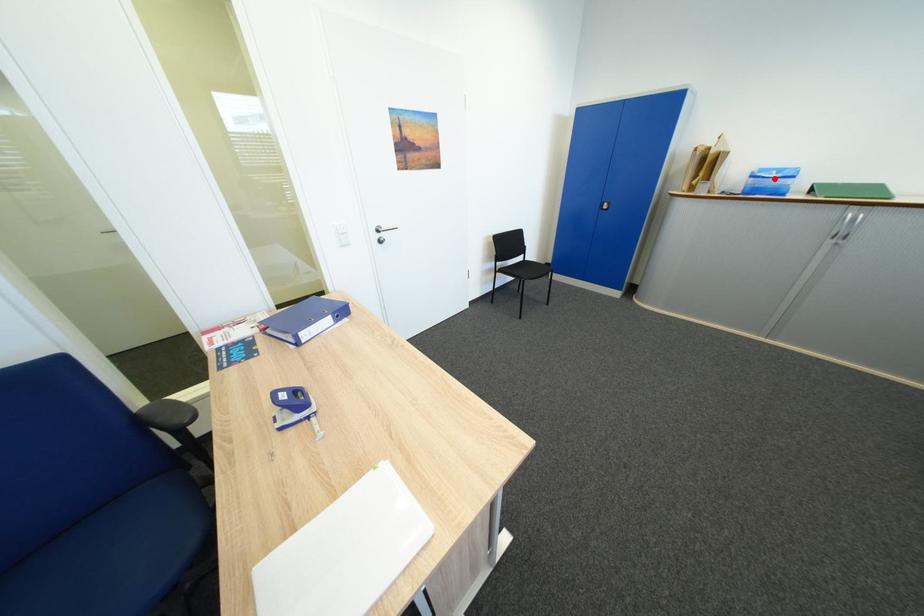
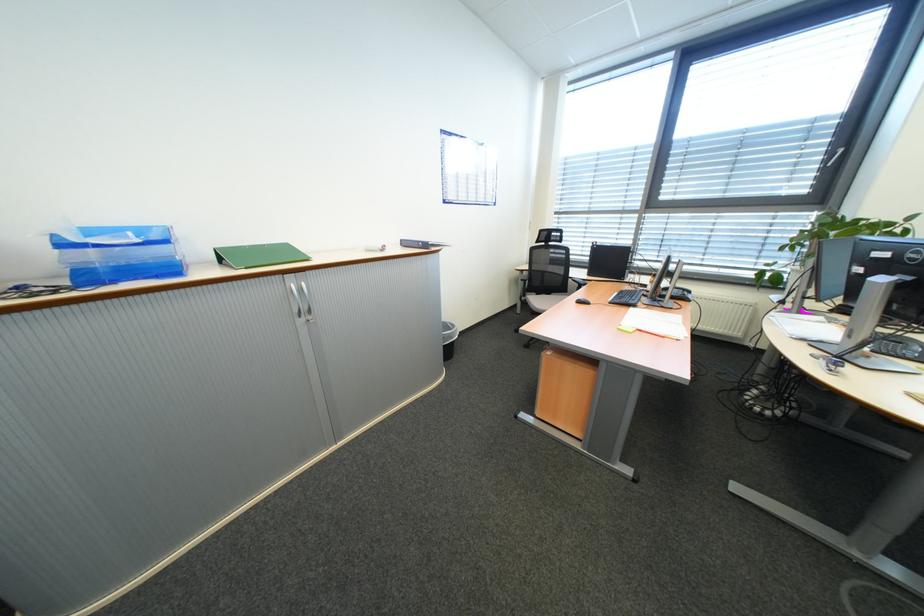
Locate, in the second image, the point that corresponds to the highlighted location in the first image.

(107, 246)